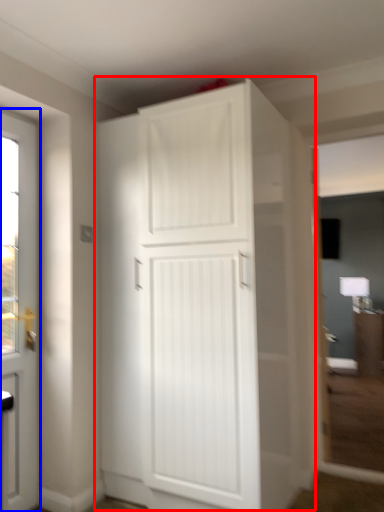
Question: Which object appears farthest to the camera in this image, cupboard (highlighted by a red box) or door (highlighted by a blue box)?

Choices:
 (A) cupboard
 (B) door

Answer: (B)